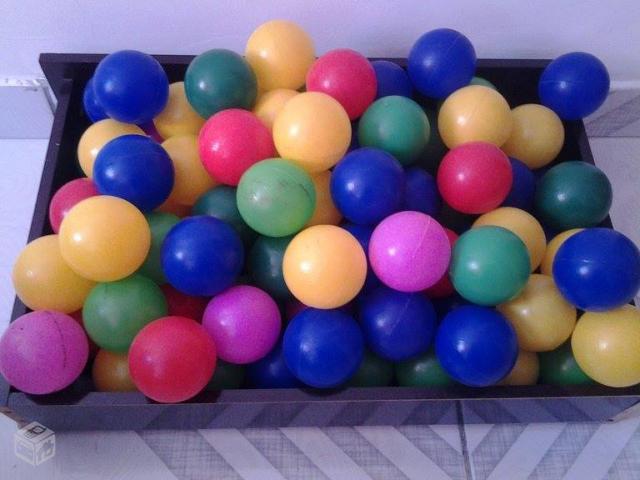
The width and height of the screenshot is (640, 480). What are the coordinates of `back wall` in the screenshot? It's located at (130, 31).